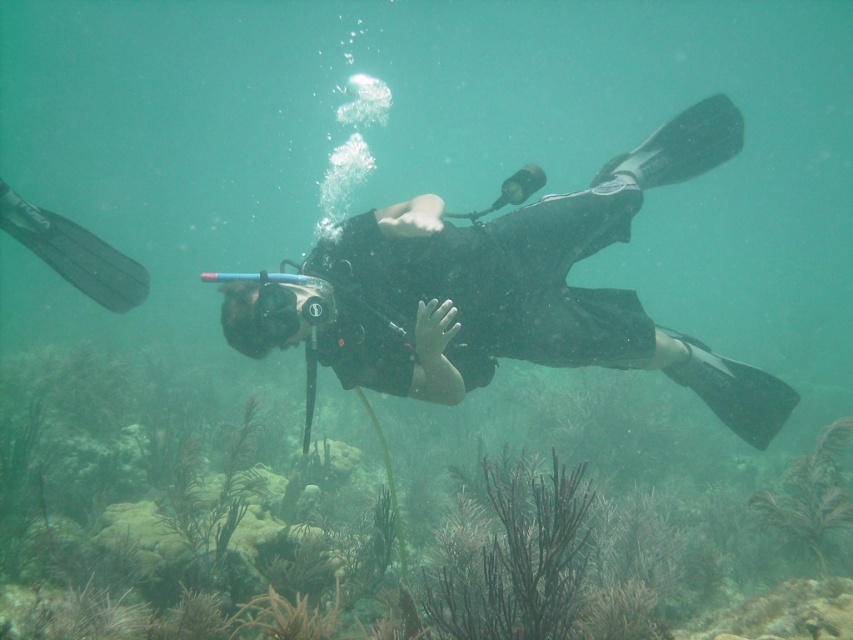
In the scene shown: Does brown coral at center have a greater width compared to matte black goggles at center?

Correct, the width of brown coral at center exceeds that of matte black goggles at center.

Is the position of brown coral at center less distant than that of matte black goggles at center?

Yes, it is in front of matte black goggles at center.

Between point (399, 460) and point (282, 328), which one is positioned in front?

Point (282, 328) is more forward.

Locate an element on the screen. This screenshot has width=853, height=640. brown coral at center is located at coordinates (401, 509).

Is brown coral at center below black matte scuba diver at center?

Yes.

Between point (663, 451) and point (425, 280), which one is positioned behind?

The point (663, 451) is more distant.

Does point (328, 589) lie behind point (527, 316)?

Yes, point (328, 589) is farther from viewer.

The height and width of the screenshot is (640, 853). What are the coordinates of `brown coral at center` in the screenshot? It's located at (401, 509).

Can you confirm if black matte scuba diver at center is thinner than matte black goggles at center?

In fact, black matte scuba diver at center might be wider than matte black goggles at center.

Which is more to the right, black matte scuba diver at center or matte black goggles at center?

Positioned to the right is black matte scuba diver at center.

Is point (451, 365) closer to viewer compared to point (312, 289)?

Yes, it is in front of point (312, 289).

Where is `black matte scuba diver at center`? Image resolution: width=853 pixels, height=640 pixels. black matte scuba diver at center is located at coordinates (529, 289).